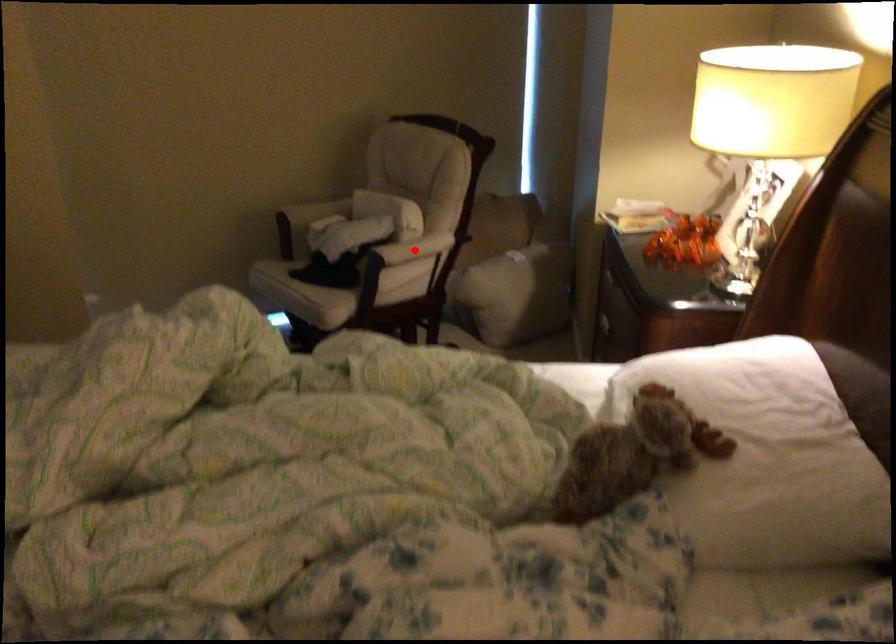
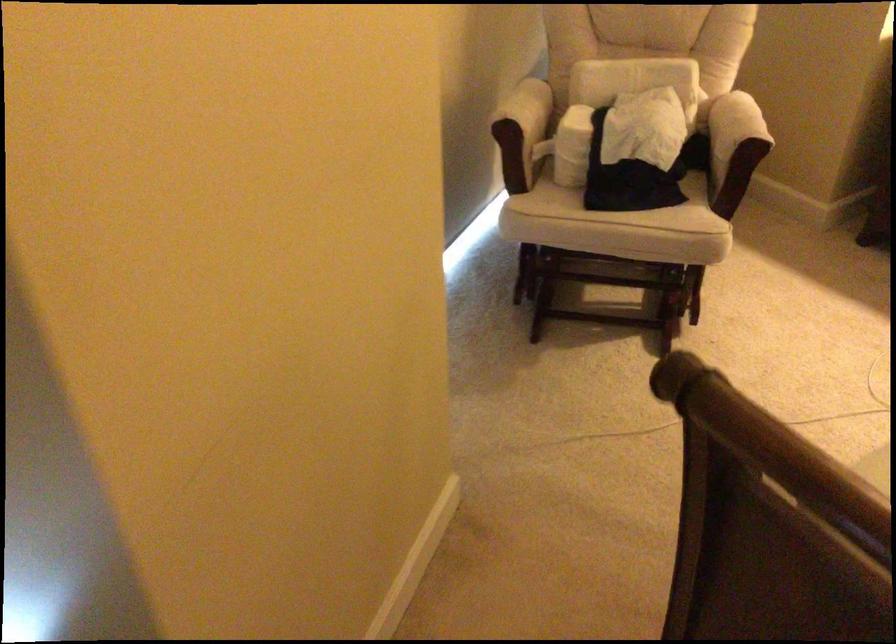
Where in the second image is the point corresponding to the highlighted location from the first image?

(778, 128)